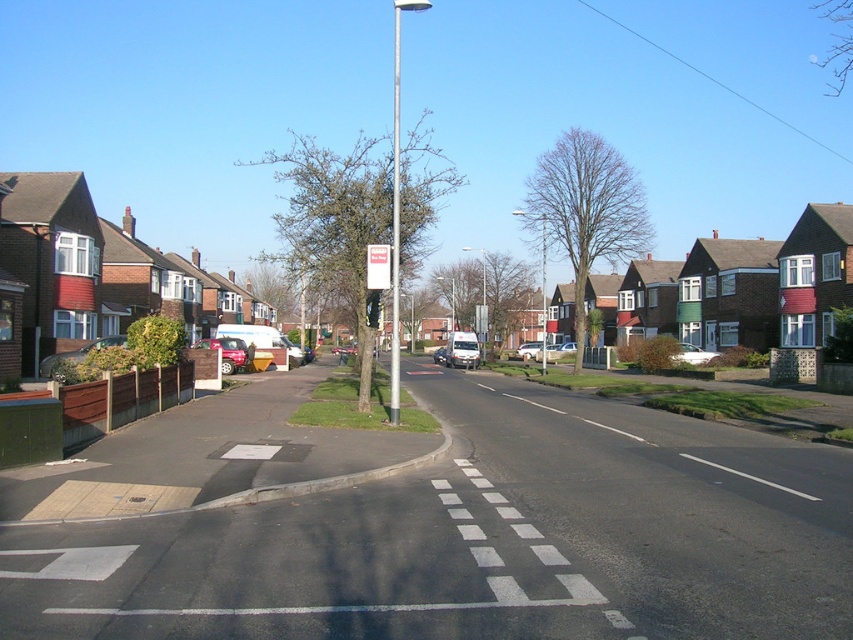
Can you confirm if metallic red car at left is positioned above silver metallic car at center?

Indeed, metallic red car at left is positioned over silver metallic car at center.

Does metallic red car at left appear under silver metallic car at center?

Incorrect, metallic red car at left is not positioned below silver metallic car at center.

I want to click on metallic red car at left, so click(x=225, y=352).

Consider the image. Can you confirm if silver metallic pole at center is positioned above white plastic sign at center?

Correct, silver metallic pole at center is located above white plastic sign at center.

Who is more forward, (393, 51) or (380, 282)?

Positioned in front is point (380, 282).

Who is more forward, (393, 344) or (387, 260)?

Positioned in front is point (393, 344).

The height and width of the screenshot is (640, 853). What are the coordinates of `silver metallic pole at center` in the screenshot? It's located at (395, 228).

Is white plastic sign at center below silver metallic car at center?

No, white plastic sign at center is not below silver metallic car at center.

Identify the location of white plastic sign at center. (376, 266).

Locate an element on the screen. The image size is (853, 640). white plastic sign at center is located at coordinates (376, 266).